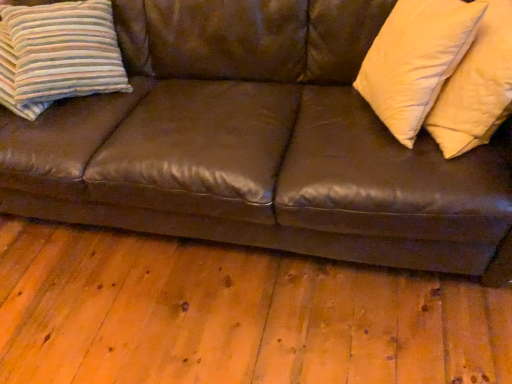
Question: From a real-world perspective, is striped fabric pillow at left, acting as the third pillow starting from the right, on brown leather couch at center?

Choices:
 (A) no
 (B) yes

Answer: (B)

Question: Can you confirm if striped fabric pillow at left, which ranks as the 1th pillow in left-to-right order, is wider than brown leather couch at center?

Choices:
 (A) yes
 (B) no

Answer: (B)

Question: Is striped fabric pillow at left, which ranks as the 1th pillow in left-to-right order, turned away from brown leather couch at center?

Choices:
 (A) no
 (B) yes

Answer: (B)

Question: Are striped fabric pillow at left, acting as the third pillow starting from the right, and brown leather couch at center located far from each other?

Choices:
 (A) yes
 (B) no

Answer: (B)

Question: From the image's perspective, is striped fabric pillow at left, which ranks as the 1th pillow in left-to-right order, over brown leather couch at center?

Choices:
 (A) no
 (B) yes

Answer: (B)

Question: From a real-world perspective, is striped fabric pillow at left, acting as the third pillow starting from the right, under brown leather couch at center?

Choices:
 (A) no
 (B) yes

Answer: (A)

Question: From the image's perspective, is soft cream pillow at right, which is the second pillow in left-to-right order, beneath brown leather couch at center?

Choices:
 (A) no
 (B) yes

Answer: (A)

Question: Can you confirm if soft cream pillow at right, which is the second pillow in left-to-right order, is smaller than brown leather couch at center?

Choices:
 (A) no
 (B) yes

Answer: (B)

Question: Considering the relative sizes of soft cream pillow at right, placed as the second pillow when sorted from right to left, and brown leather couch at center in the image provided, is soft cream pillow at right, placed as the second pillow when sorted from right to left, thinner than brown leather couch at center?

Choices:
 (A) no
 (B) yes

Answer: (B)

Question: Is soft cream pillow at right, placed as the second pillow when sorted from right to left, directly adjacent to brown leather couch at center?

Choices:
 (A) no
 (B) yes

Answer: (A)

Question: Is soft cream pillow at right, placed as the second pillow when sorted from right to left, shorter than brown leather couch at center?

Choices:
 (A) yes
 (B) no

Answer: (A)

Question: Is soft cream pillow at right, which is the second pillow in left-to-right order, closer to camera compared to brown leather couch at center?

Choices:
 (A) yes
 (B) no

Answer: (B)

Question: Considering the relative sizes of soft yellow pillow at right, the third pillow from the left, and striped fabric pillow at left, acting as the third pillow starting from the right, in the image provided, is soft yellow pillow at right, the third pillow from the left, shorter than striped fabric pillow at left, acting as the third pillow starting from the right,?

Choices:
 (A) no
 (B) yes

Answer: (A)